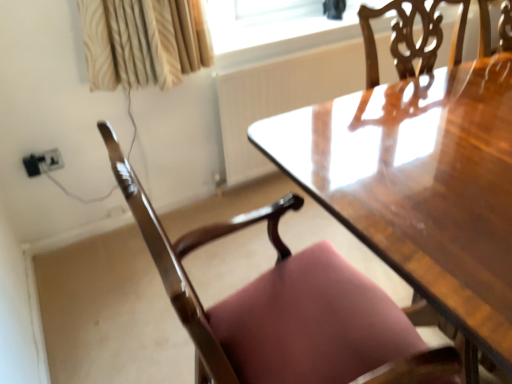
Question: From their relative heights in the image, would you say glossy wood chair at lower left is taller or shorter than black plastic outlet at lower left?

Choices:
 (A) short
 (B) tall

Answer: (B)

Question: From a real-world perspective, is glossy wood chair at lower left physically located above or below black plastic outlet at lower left?

Choices:
 (A) below
 (B) above

Answer: (B)

Question: Estimate the real-world distances between objects in this image. Which object is closer to the transparent glass window screen at upper center?

Choices:
 (A) black plastic outlet at lower left
 (B) glossy wood chair at lower left

Answer: (A)

Question: Considering the real-world distances, which object is farthest from the glossy wood chair at lower left?

Choices:
 (A) black plastic outlet at lower left
 (B) transparent glass window screen at upper center

Answer: (A)